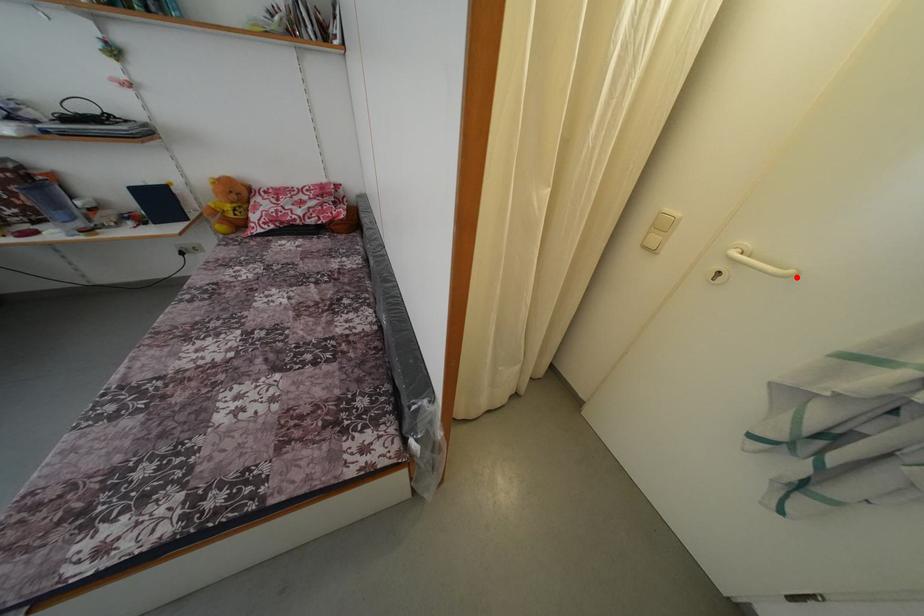
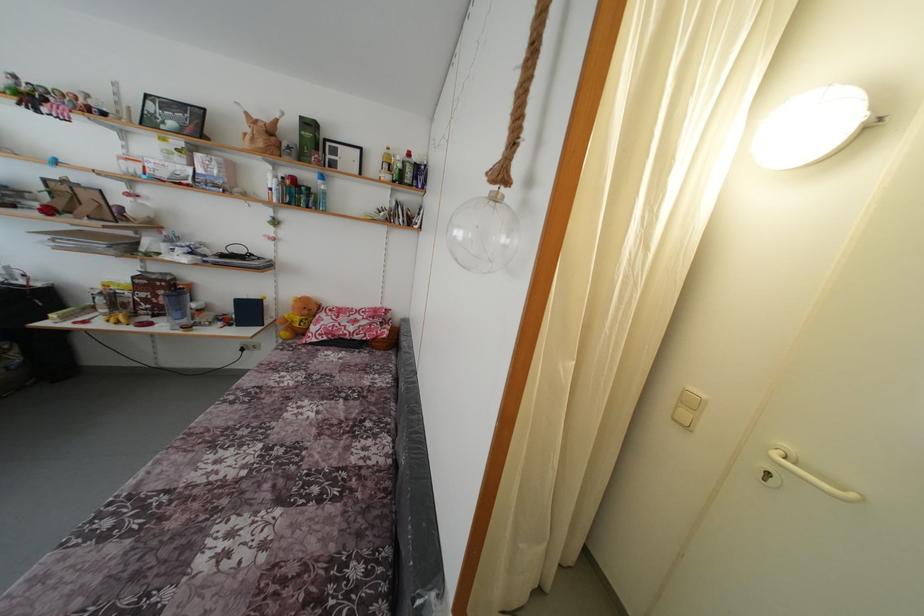
Find the pixel in the second image that matches the highlighted location in the first image.

(859, 501)